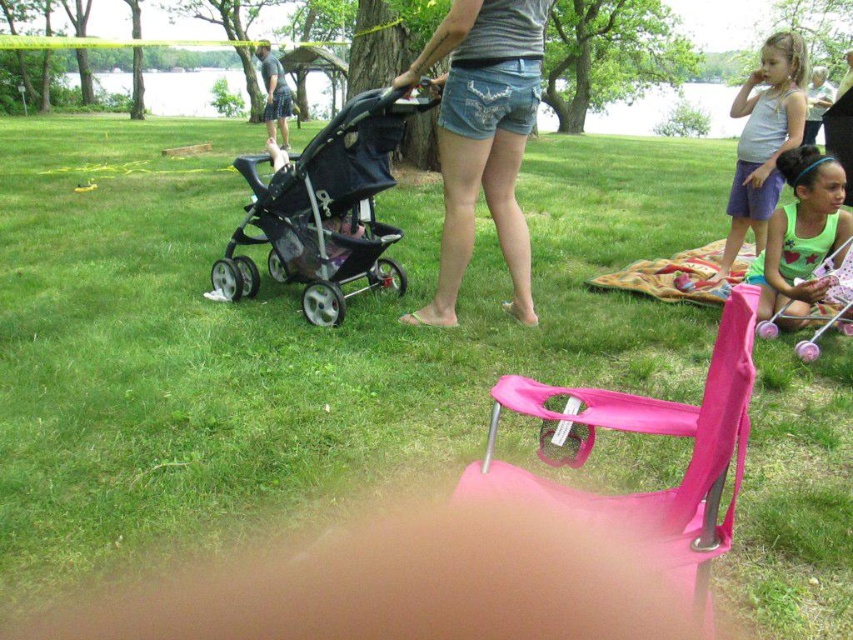
Which is above, green fabric doll at lower right or multicolored woven blanket at lower right?

green fabric doll at lower right is above.

Consider the image. How far apart are green fabric doll at lower right and multicolored woven blanket at lower right?

green fabric doll at lower right and multicolored woven blanket at lower right are 47.71 centimeters apart.

Is point (801, 260) positioned before point (660, 266)?

That is True.

At what (x,y) coordinates should I click in order to perform the action: click on green fabric doll at lower right. Please return your answer as a coordinate pair (x, y). The width and height of the screenshot is (853, 640). Looking at the image, I should click on (801, 236).

Who is shorter, black mesh stroller at center or green fabric doll at lower right?

With less height is green fabric doll at lower right.

Which is below, black mesh stroller at center or green fabric doll at lower right?

green fabric doll at lower right is lower down.

Which is in front, point (299, 157) or point (817, 188)?

Point (299, 157) is more forward.

Locate an element on the screen. This screenshot has width=853, height=640. black mesh stroller at center is located at coordinates (325, 209).

Between denim shorts at center and multicolored woven blanket at lower right, which one has less height?

Standing shorter between the two is multicolored woven blanket at lower right.

Which is more to the right, denim shorts at center or multicolored woven blanket at lower right?

From the viewer's perspective, multicolored woven blanket at lower right appears more on the right side.

Image resolution: width=853 pixels, height=640 pixels. I want to click on denim shorts at center, so click(483, 138).

Locate an element on the screen. The image size is (853, 640). denim shorts at center is located at coordinates (483, 138).